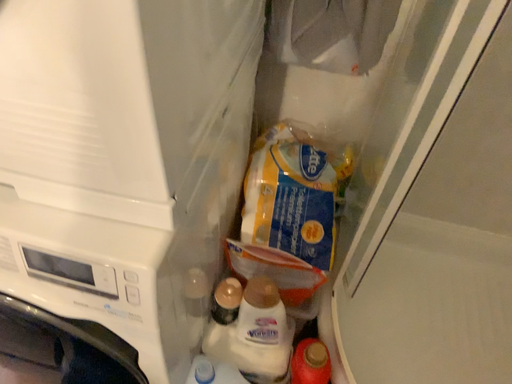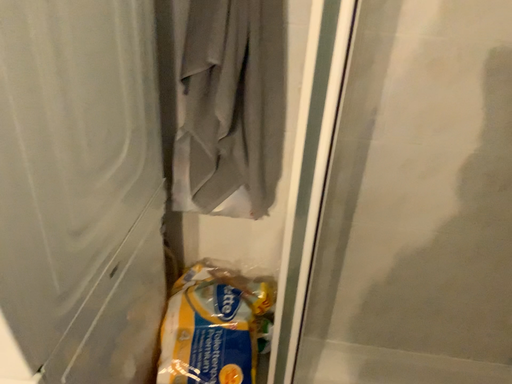
Question: How did the camera likely rotate when shooting the video?

Choices:
 (A) rotated upward
 (B) rotated downward

Answer: (A)